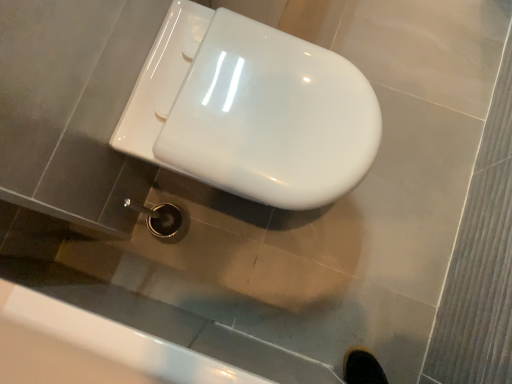
Find the location of a particular element. The height and width of the screenshot is (384, 512). blank space situated above white glossy toilet at center (from a real-world perspective) is located at coordinates (247, 105).